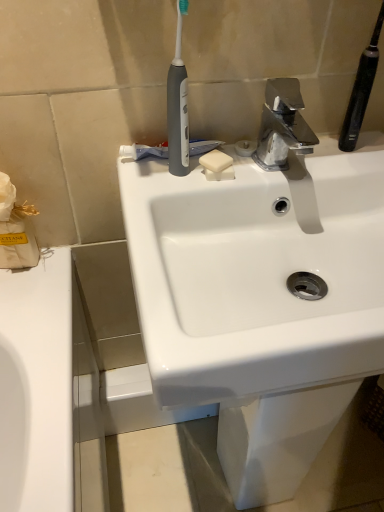
Identify the location of vacant area situated to the left side of polished chrome faucet at upper center. Image resolution: width=384 pixels, height=512 pixels. click(x=201, y=175).